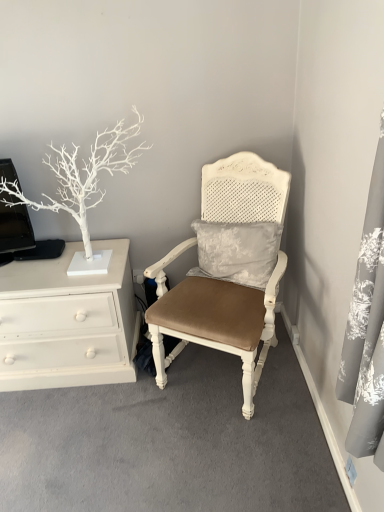
Find the location of a particular element. Image resolution: width=384 pixels, height=512 pixels. vacant region below white matte tree at left (from a real-world perspective) is located at coordinates (71, 270).